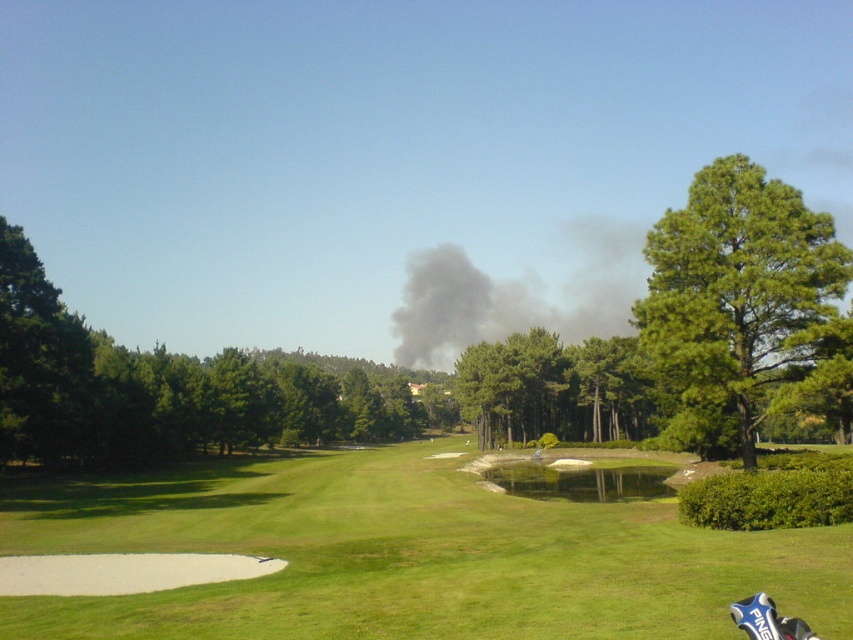
Based on the photo, you are a golfer standing on the fairway and see the green grass at center and the green leafy tree at left. Which object is nearer to you?

The green grass at center is closer to the viewer than the green leafy tree at left.